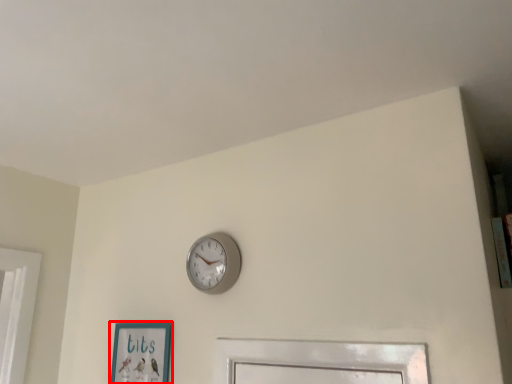
Question: In this image, where is picture frame (annotated by the red box) located relative to wall clock?

Choices:
 (A) left
 (B) right

Answer: (A)